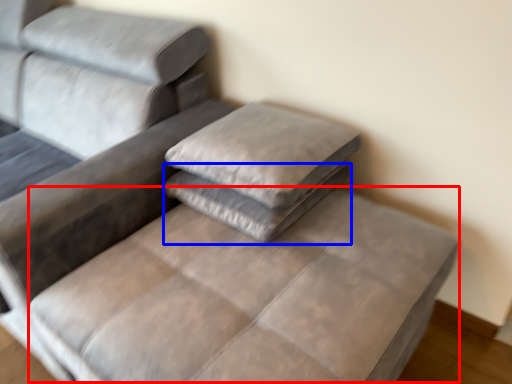
Question: Which point is further to the camera, mattress (highlighted by a red box) or pillow (highlighted by a blue box)?

Choices:
 (A) mattress
 (B) pillow

Answer: (B)